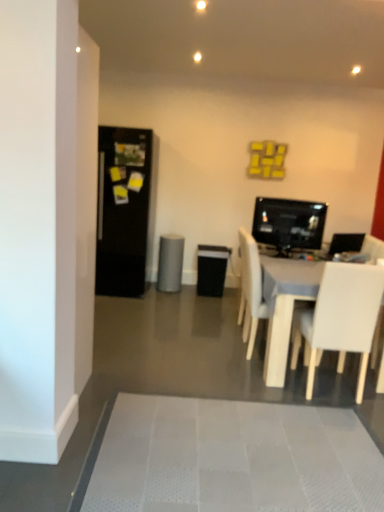
What are the coordinates of `vacant space situated on the left part of white plastic entertainment center at lower right` in the screenshot? It's located at (173, 339).